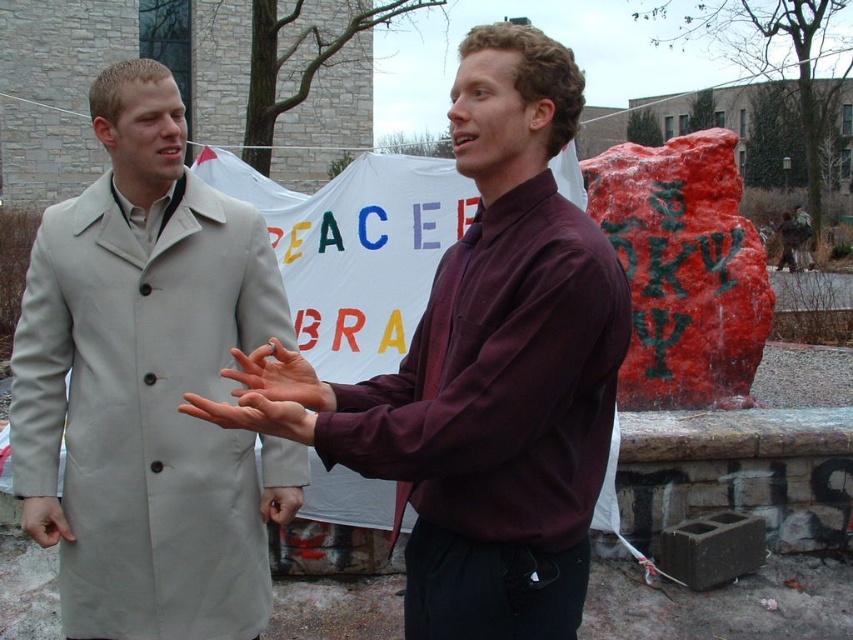
You are standing 2 meters away from the banner in the background. Can you reach the point at coordinate point (50, 378) on the banner with your outstretched hand?

The distance of point (50, 378) from viewer is 2.32 meters, so you are 2 meters away but the point is 0.32 meters further away. You cannot reach it with your outstretched hand.

You are a photographer trying to capture a candid shot of the smooth skin hand at center without including the light beige trench coat at left in the frame. Is this possible based on their positions?

The light beige trench coat at left is located above the smooth skin hand at center, so it might block the view. To capture the hand without the coat, you need to adjust the angle or position to ensure the coat isn